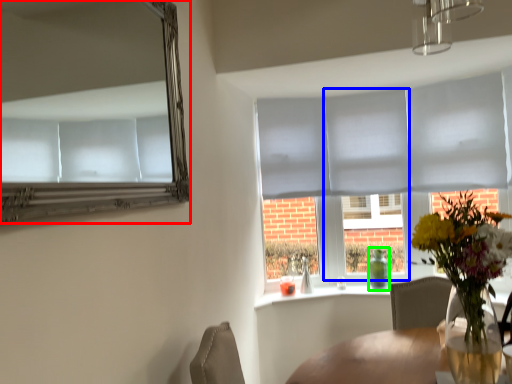
Question: Which object is positioned farthest from mirror (highlighted by a red box)? Select from glass door (highlighted by a blue box) and bottle (highlighted by a green box).

Choices:
 (A) glass door
 (B) bottle

Answer: (B)